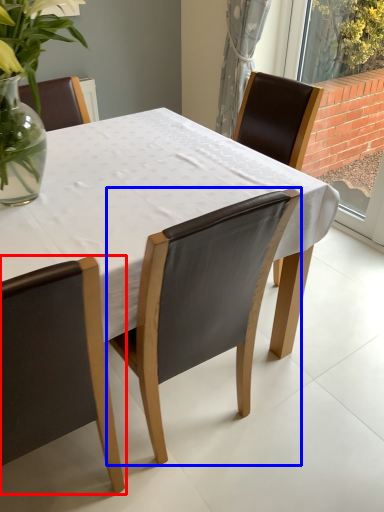
Question: Which of the following is the closest to the observer, chair (highlighted by a red box) or chair (highlighted by a blue box)?

Choices:
 (A) chair
 (B) chair

Answer: (A)